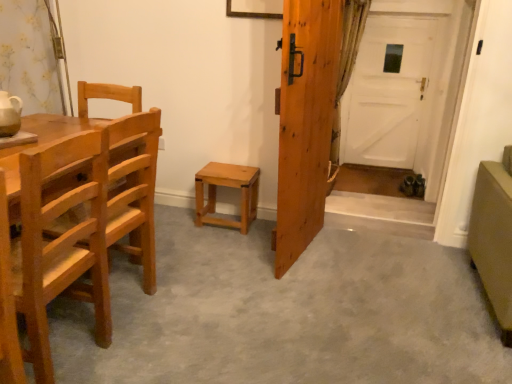
The height and width of the screenshot is (384, 512). Find the location of `vacant space in front of wooden door at center, which appears as the 2th door when viewed from the right`. vacant space in front of wooden door at center, which appears as the 2th door when viewed from the right is located at coordinates (314, 289).